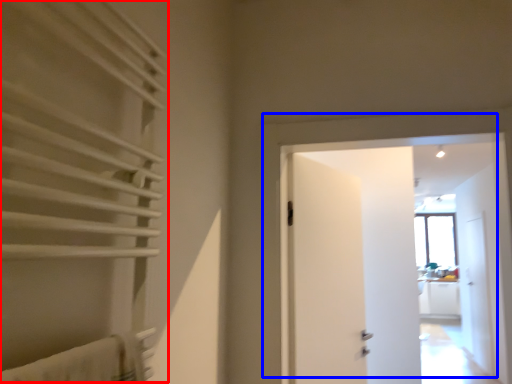
Question: Which point is closer to the camera, curtain (highlighted by a red box) or door (highlighted by a blue box)?

Choices:
 (A) curtain
 (B) door

Answer: (A)